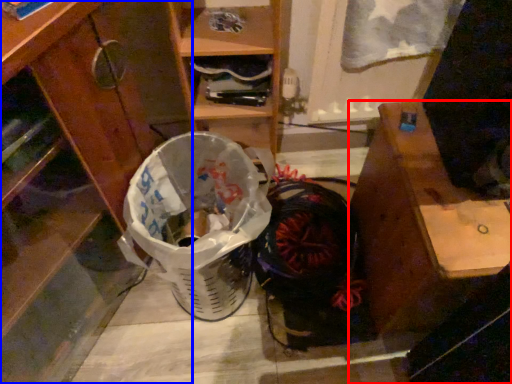
Question: Which of the following is the closest to the observer, desk (highlighted by a red box) or cabinetry (highlighted by a blue box)?

Choices:
 (A) desk
 (B) cabinetry

Answer: (B)